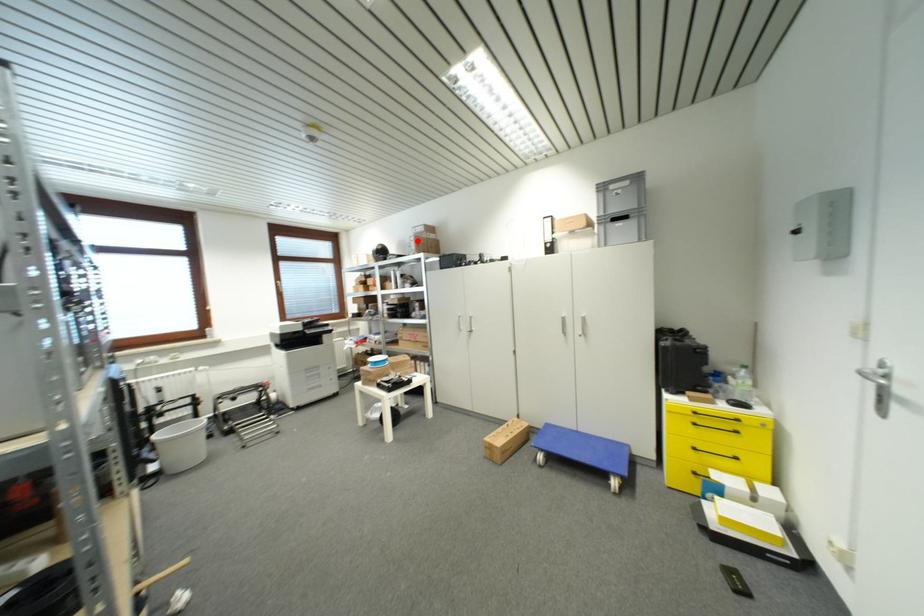
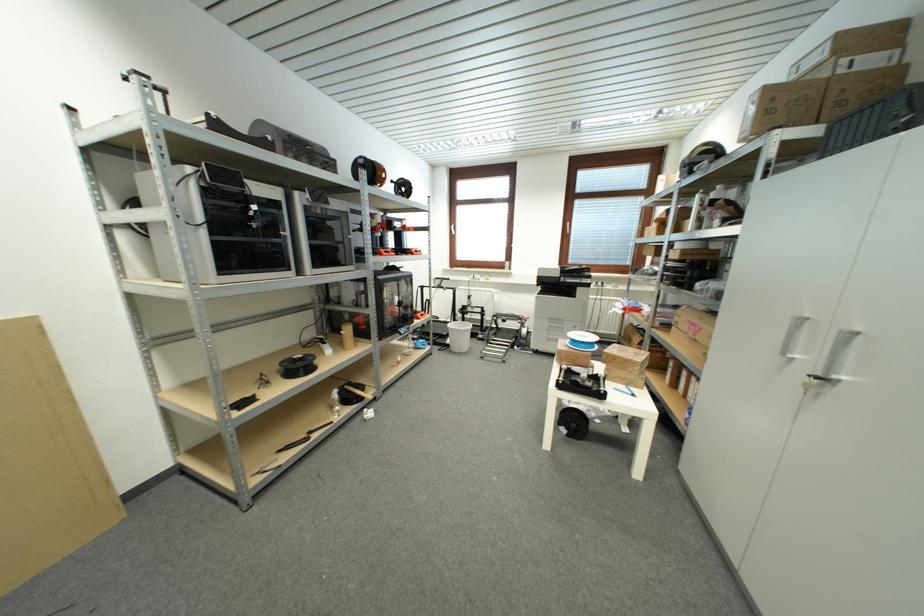
Where in the second image is the point corresponding to the highlighted location from the first image?

(761, 99)